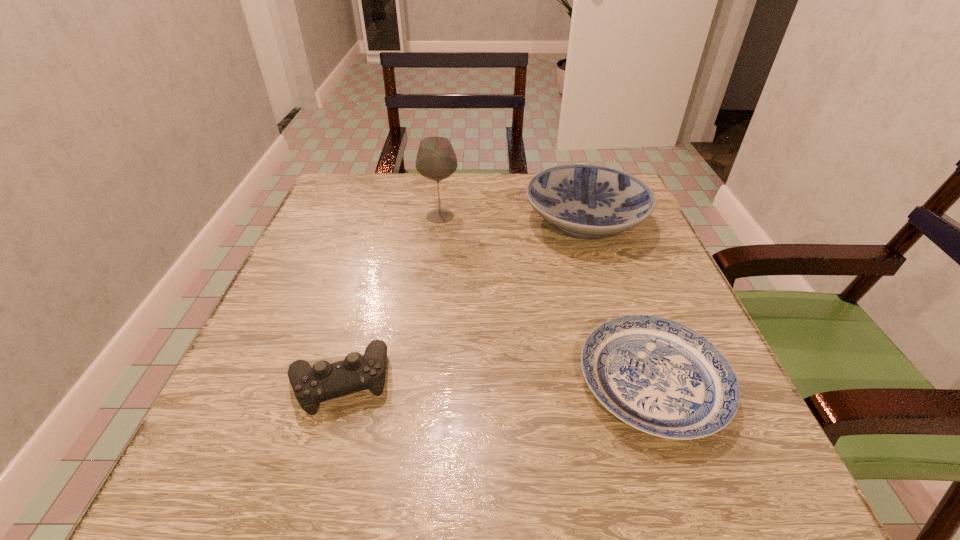
Find the location of a particular element. free region located 0.380m on the right of the control is located at coordinates 629,381.

Where is `free space located on the back of the shortest object`? This screenshot has height=540, width=960. free space located on the back of the shortest object is located at coordinates (612, 267).

Where is `wineglass present at the far edge`? wineglass present at the far edge is located at coordinates (436, 160).

At what (x,y) coordinates should I click in order to perform the action: click on plate present at the far edge. Please return your answer as a coordinate pair (x, y). This screenshot has height=540, width=960. Looking at the image, I should click on (585, 201).

This screenshot has height=540, width=960. Identify the location of object that is at the near edge. (659, 376).

Where is `object at the left edge`? Image resolution: width=960 pixels, height=540 pixels. object at the left edge is located at coordinates (312, 385).

In order to click on object present at the far right corner in this screenshot , I will do `click(585, 201)`.

I want to click on object that is at the near right corner, so click(659, 376).

Where is `vacant space at the far edge of the desktop`? The image size is (960, 540). vacant space at the far edge of the desktop is located at coordinates (486, 211).

Image resolution: width=960 pixels, height=540 pixels. What are the coordinates of `blank space at the near edge` in the screenshot? It's located at (321, 451).